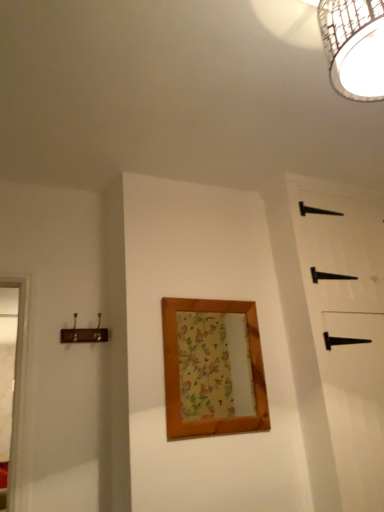
Where is `woven bamboo light fixture at upper right`? This screenshot has width=384, height=512. woven bamboo light fixture at upper right is located at coordinates tap(354, 46).

Measure the distance between point (21, 279) and camera.

Point (21, 279) is 6.95 feet from camera.

Identify the location of black matte barn door at right. The width and height of the screenshot is (384, 512). (339, 339).

The width and height of the screenshot is (384, 512). I want to click on woven bamboo light fixture at upper right, so click(x=354, y=46).

Is woven bamboo light fixture at upper right facing towards white wood window frame at left?

No, woven bamboo light fixture at upper right is not aimed at white wood window frame at left.

What's the angular difference between woven bamboo light fixture at upper right and white wood window frame at left's facing directions?

179 degrees separate the facing orientations of woven bamboo light fixture at upper right and white wood window frame at left.

Locate an element on the screen. This screenshot has width=384, height=512. window frame behind the woven bamboo light fixture at upper right is located at coordinates (12, 379).

Which object is thinner, woven bamboo light fixture at upper right or white wood window frame at left?

white wood window frame at left is thinner.

Who is more distant, wooden framed mirror at center or white wood window frame at left?

Positioned behind is wooden framed mirror at center.

Is wooden framed mirror at center situated inside white wood window frame at left or outside?

wooden framed mirror at center is outside white wood window frame at left.

Which is closer to the camera, (194, 327) or (2, 328)?

The point (2, 328) is closer.

From a real-world perspective, is white wood window frame at left physically located above or below black matte barn door at right?

From a real-world perspective, white wood window frame at left is physically below black matte barn door at right.

Based on the photo, does white wood window frame at left have a greater height compared to black matte barn door at right?

No.

Is white wood window frame at left facing away from black matte barn door at right?

That's not correct — white wood window frame at left is not looking away from black matte barn door at right.

From the image's perspective, relative to black matte barn door at right, is white wood window frame at left above or below?

From the image's perspective, white wood window frame at left appears below black matte barn door at right.

Which object is closer to the camera taking this photo, black matte barn door at right or white wood window frame at left?

white wood window frame at left.

Which of these two, black matte barn door at right or white wood window frame at left, is smaller?

white wood window frame at left.

Locate an element on the screen. The width and height of the screenshot is (384, 512). window frame below the black matte barn door at right (from a real-world perspective) is located at coordinates (12, 379).

From the image's perspective, is black matte barn door at right above or below white wood window frame at left?

black matte barn door at right is situated higher than white wood window frame at left in the image.

Is there a large distance between white wood window frame at left and wooden framed mirror at center?

That's not correct — white wood window frame at left is a little close to wooden framed mirror at center.

In the image, is white wood window frame at left on the left side or the right side of wooden framed mirror at center?

Based on their positions, white wood window frame at left is located to the left of wooden framed mirror at center.

Is white wood window frame at left shorter than wooden framed mirror at center?

No.

Is the surface of wooden framed mirror at center in direct contact with black matte barn door at right?

No, wooden framed mirror at center is not in contact with black matte barn door at right.

Is wooden framed mirror at center wider or thinner than black matte barn door at right?

Considering their sizes, wooden framed mirror at center looks slimmer than black matte barn door at right.

From the picture: Can black matte barn door at right be found inside wooden framed mirror at center?

No, black matte barn door at right is not surrounded by wooden framed mirror at center.

In terms of size, does wooden framed mirror at center appear bigger or smaller than black matte barn door at right?

wooden framed mirror at center is smaller than black matte barn door at right.

Considering the relative sizes of woven bamboo light fixture at upper right and wooden framed mirror at center in the image provided, is woven bamboo light fixture at upper right taller than wooden framed mirror at center?

Incorrect, the height of woven bamboo light fixture at upper right is not larger of that of wooden framed mirror at center.

Which of these two, woven bamboo light fixture at upper right or wooden framed mirror at center, is wider?

woven bamboo light fixture at upper right is wider.

Which is more to the left, woven bamboo light fixture at upper right or wooden framed mirror at center?

wooden framed mirror at center is more to the left.

Where is `mirror that is under the woven bamboo light fixture at upper right (from a real-world perspective)`? The width and height of the screenshot is (384, 512). mirror that is under the woven bamboo light fixture at upper right (from a real-world perspective) is located at coordinates (214, 366).

Find the location of a particular element. This screenshot has width=384, height=512. lamp located above the white wood window frame at left (from the image's perspective) is located at coordinates (354, 46).

Identify the location of window frame below the wooden framed mirror at center (from the image's perspective). (12, 379).

Estimate the real-world distances between objects in this image. Which object is further from black matte barn door at right, wooden framed mirror at center or woven bamboo light fixture at upper right?

Based on the image, woven bamboo light fixture at upper right appears to be further to black matte barn door at right.

From the image, which object appears to be farther from wooden framed mirror at center, woven bamboo light fixture at upper right or white wood window frame at left?

Based on the image, woven bamboo light fixture at upper right appears to be further to wooden framed mirror at center.

Which object lies further to the anchor point black matte barn door at right, white wood window frame at left or woven bamboo light fixture at upper right?

white wood window frame at left is further to black matte barn door at right.

From the image, which object appears to be farther from white wood window frame at left, woven bamboo light fixture at upper right or wooden framed mirror at center?

woven bamboo light fixture at upper right.

Based on their spatial positions, is black matte barn door at right or woven bamboo light fixture at upper right closer to wooden framed mirror at center?

black matte barn door at right is closer to wooden framed mirror at center.

When comparing their distances from white wood window frame at left, does black matte barn door at right or woven bamboo light fixture at upper right seem closer?

black matte barn door at right.

Looking at the image, which one is located closer to white wood window frame at left, wooden framed mirror at center or woven bamboo light fixture at upper right?

The object closer to white wood window frame at left is wooden framed mirror at center.

Which object lies further to the anchor point white wood window frame at left, black matte barn door at right or wooden framed mirror at center?

black matte barn door at right is further to white wood window frame at left.

Where is `mirror between white wood window frame at left and woven bamboo light fixture at upper right`? Image resolution: width=384 pixels, height=512 pixels. mirror between white wood window frame at left and woven bamboo light fixture at upper right is located at coordinates (214, 366).

The image size is (384, 512). Find the location of `lamp situated between white wood window frame at left and black matte barn door at right from left to right`. lamp situated between white wood window frame at left and black matte barn door at right from left to right is located at coordinates (354, 46).

This screenshot has width=384, height=512. I want to click on barn door between woven bamboo light fixture at upper right and wooden framed mirror at center from top to bottom, so click(339, 339).

Identify the location of mirror between white wood window frame at left and black matte barn door at right in the horizontal direction. (214, 366).